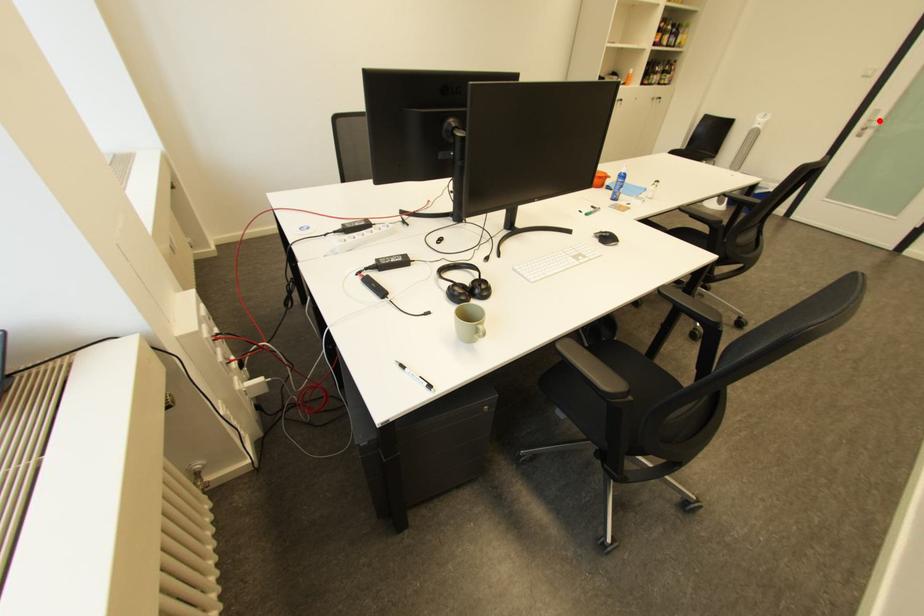
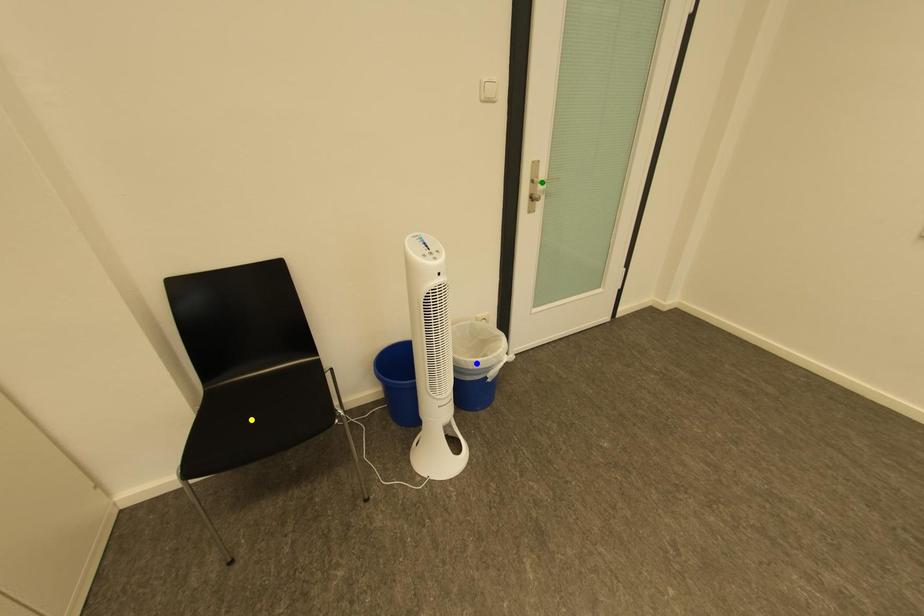
Question: I am providing you with two images of the same scene from different viewpoints. A red point is marked on the first image. You are given multiple points on the second image. Which point in image 2 is actually the same real-world point as the red point in image 1?

Choices:
 (A) green point
 (B) blue point
 (C) yellow point

Answer: (A)